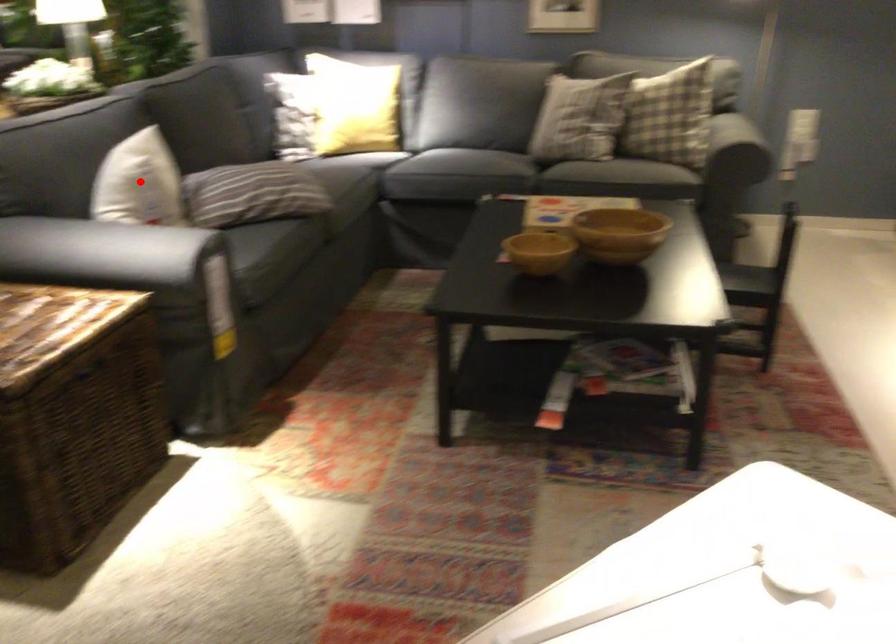
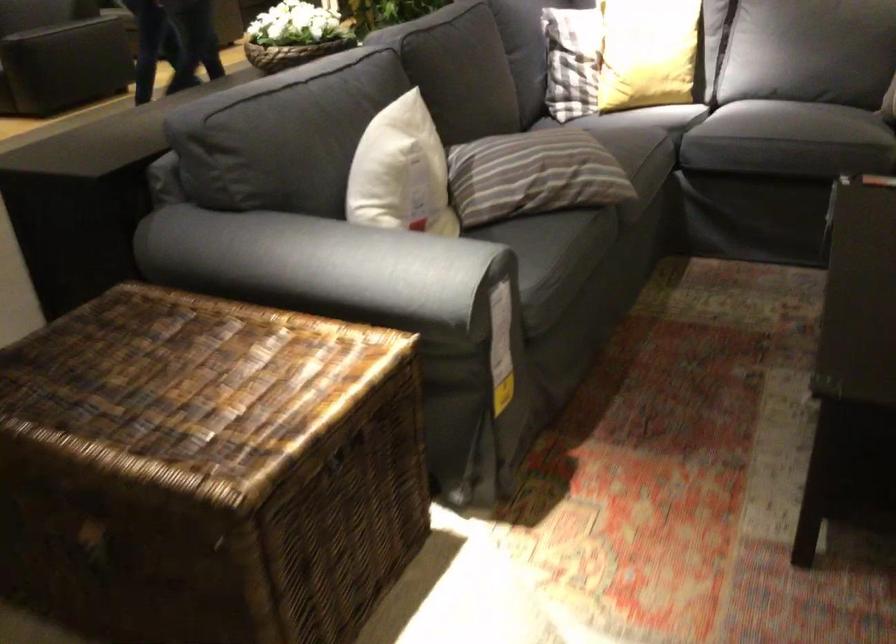
Find the pixel in the second image that matches the highlighted location in the first image.

(401, 172)